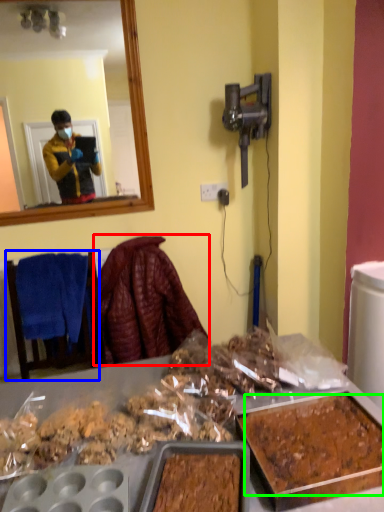
Question: Which object is the closest to the blanket (highlighted by a red box)? Choose among these: furniture (highlighted by a blue box) or food (highlighted by a green box).

Choices:
 (A) furniture
 (B) food

Answer: (A)